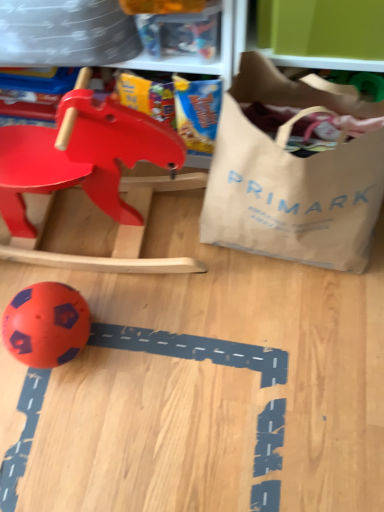
Where is `matte plastic rocking horse at upper left, the first toy when ordered from top to bottom`? The height and width of the screenshot is (512, 384). matte plastic rocking horse at upper left, the first toy when ordered from top to bottom is located at coordinates (92, 177).

Between brown paper bag at right and matte plastic rocking horse at upper left, placed as the second toy when sorted from bottom to top, which one has smaller width?

Thinner between the two is matte plastic rocking horse at upper left, placed as the second toy when sorted from bottom to top.

From the image's perspective, between brown paper bag at right and matte plastic rocking horse at upper left, placed as the second toy when sorted from bottom to top, who is located below?

From the image's view, matte plastic rocking horse at upper left, placed as the second toy when sorted from bottom to top, is below.

Does brown paper bag at right contain matte plastic rocking horse at upper left, placed as the second toy when sorted from bottom to top?

Actually, matte plastic rocking horse at upper left, placed as the second toy when sorted from bottom to top, is outside brown paper bag at right.

Does orange rubber ball at lower left, positioned as the first toy in bottom-to-top order, have a smaller size compared to brown paper bag at right?

Indeed, orange rubber ball at lower left, positioned as the first toy in bottom-to-top order, has a smaller size compared to brown paper bag at right.

From the image's perspective, which object appears higher, orange rubber ball at lower left, positioned as the first toy in bottom-to-top order, or brown paper bag at right?

From the image's view, brown paper bag at right is above.

Which is farther from the camera, (39, 292) or (249, 130)?

The point (39, 292) is more distant.

From a real-world perspective, starting from the brown paper bag at right, which toy is the 2nd one below it? Please provide its 2D coordinates.

[(46, 324)]

Looking at this image, is matte plastic rocking horse at upper left, placed as the second toy when sorted from bottom to top, situated inside orange rubber ball at lower left, the 2th toy positioned from the top, or outside?

matte plastic rocking horse at upper left, placed as the second toy when sorted from bottom to top, is located beyond the bounds of orange rubber ball at lower left, the 2th toy positioned from the top.

Looking at this image, is matte plastic rocking horse at upper left, placed as the second toy when sorted from bottom to top, oriented towards orange rubber ball at lower left, the 2th toy positioned from the top?

Yes, matte plastic rocking horse at upper left, placed as the second toy when sorted from bottom to top, faces towards orange rubber ball at lower left, the 2th toy positioned from the top.

Is matte plastic rocking horse at upper left, placed as the second toy when sorted from bottom to top, not close to orange rubber ball at lower left, the 2th toy positioned from the top?

matte plastic rocking horse at upper left, placed as the second toy when sorted from bottom to top, is actually quite close to orange rubber ball at lower left, the 2th toy positioned from the top.

Which is correct: orange rubber ball at lower left, positioned as the first toy in bottom-to-top order, is inside matte plastic rocking horse at upper left, the first toy when ordered from top to bottom, or outside of it?

orange rubber ball at lower left, positioned as the first toy in bottom-to-top order, cannot be found inside matte plastic rocking horse at upper left, the first toy when ordered from top to bottom.

In the scene shown: Is orange rubber ball at lower left, the 2th toy positioned from the top, facing away from matte plastic rocking horse at upper left, the first toy when ordered from top to bottom?

Absolutely, orange rubber ball at lower left, the 2th toy positioned from the top, is directed away from matte plastic rocking horse at upper left, the first toy when ordered from top to bottom.

Does orange rubber ball at lower left, positioned as the first toy in bottom-to-top order, touch matte plastic rocking horse at upper left, placed as the second toy when sorted from bottom to top?

orange rubber ball at lower left, positioned as the first toy in bottom-to-top order, is not next to matte plastic rocking horse at upper left, placed as the second toy when sorted from bottom to top, and they're not touching.

Considering the relative sizes of orange rubber ball at lower left, positioned as the first toy in bottom-to-top order, and matte plastic rocking horse at upper left, the first toy when ordered from top to bottom, in the image provided, is orange rubber ball at lower left, positioned as the first toy in bottom-to-top order, taller than matte plastic rocking horse at upper left, the first toy when ordered from top to bottom,?

No.

How different are the orientations of brown paper bag at right and orange rubber ball at lower left, positioned as the first toy in bottom-to-top order, in degrees?

brown paper bag at right and orange rubber ball at lower left, positioned as the first toy in bottom-to-top order, are facing 0.261 degrees away from each other.

Could you tell me if brown paper bag at right is facing orange rubber ball at lower left, the 2th toy positioned from the top?

No, brown paper bag at right is not aimed at orange rubber ball at lower left, the 2th toy positioned from the top.

Considering the sizes of objects brown paper bag at right and orange rubber ball at lower left, the 2th toy positioned from the top, in the image provided, who is thinner, brown paper bag at right or orange rubber ball at lower left, the 2th toy positioned from the top,?

With smaller width is orange rubber ball at lower left, the 2th toy positioned from the top.

Which is in front, brown paper bag at right or orange rubber ball at lower left, positioned as the first toy in bottom-to-top order?

brown paper bag at right.

Identify the location of grocery bag above the matte plastic rocking horse at upper left, placed as the second toy when sorted from bottom to top (from the image's perspective). Image resolution: width=384 pixels, height=512 pixels. (292, 179).

From a real-world perspective, who is located higher, matte plastic rocking horse at upper left, the first toy when ordered from top to bottom, or brown paper bag at right?

brown paper bag at right.

Is matte plastic rocking horse at upper left, the first toy when ordered from top to bottom, in front of or behind brown paper bag at right in the image?

matte plastic rocking horse at upper left, the first toy when ordered from top to bottom, is behind brown paper bag at right.

Are matte plastic rocking horse at upper left, placed as the second toy when sorted from bottom to top, and brown paper bag at right beside each other?

matte plastic rocking horse at upper left, placed as the second toy when sorted from bottom to top, and brown paper bag at right are not in contact.

In order to click on grocery bag on the right side of matte plastic rocking horse at upper left, the first toy when ordered from top to bottom in this screenshot , I will do `click(292, 179)`.

Find the location of `the 2nd toy to the left of the brown paper bag at right, counting from the anchor's position`. the 2nd toy to the left of the brown paper bag at right, counting from the anchor's position is located at coordinates (46, 324).

Looking at the image, which one is located further to matte plastic rocking horse at upper left, placed as the second toy when sorted from bottom to top, orange rubber ball at lower left, positioned as the first toy in bottom-to-top order, or brown paper bag at right?

Based on the image, orange rubber ball at lower left, positioned as the first toy in bottom-to-top order, appears to be further to matte plastic rocking horse at upper left, placed as the second toy when sorted from bottom to top.

Estimate the real-world distances between objects in this image. Which object is further from orange rubber ball at lower left, the 2th toy positioned from the top, matte plastic rocking horse at upper left, the first toy when ordered from top to bottom, or brown paper bag at right?

The object further to orange rubber ball at lower left, the 2th toy positioned from the top, is brown paper bag at right.

In the scene shown: Looking at the image, which one is located closer to orange rubber ball at lower left, positioned as the first toy in bottom-to-top order, brown paper bag at right or matte plastic rocking horse at upper left, placed as the second toy when sorted from bottom to top?

The object closer to orange rubber ball at lower left, positioned as the first toy in bottom-to-top order, is matte plastic rocking horse at upper left, placed as the second toy when sorted from bottom to top.

When comparing their distances from brown paper bag at right, does matte plastic rocking horse at upper left, placed as the second toy when sorted from bottom to top, or orange rubber ball at lower left, positioned as the first toy in bottom-to-top order, seem closer?

Among the two, matte plastic rocking horse at upper left, placed as the second toy when sorted from bottom to top, is located nearer to brown paper bag at right.

When comparing their distances from matte plastic rocking horse at upper left, the first toy when ordered from top to bottom, does brown paper bag at right or orange rubber ball at lower left, the 2th toy positioned from the top, seem closer?

Based on the image, brown paper bag at right appears to be nearer to matte plastic rocking horse at upper left, the first toy when ordered from top to bottom.

Which object lies nearer to the anchor point brown paper bag at right, orange rubber ball at lower left, positioned as the first toy in bottom-to-top order, or matte plastic rocking horse at upper left, placed as the second toy when sorted from bottom to top?

Among the two, matte plastic rocking horse at upper left, placed as the second toy when sorted from bottom to top, is located nearer to brown paper bag at right.

Identify the location of toy situated between orange rubber ball at lower left, the 2th toy positioned from the top, and brown paper bag at right from left to right. (92, 177).